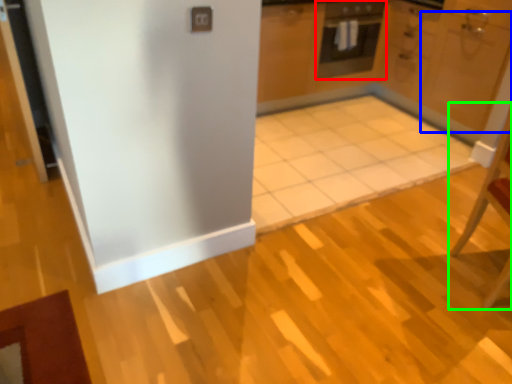
Question: Estimate the real-world distances between objects in this image. Which object is closer to oven (highlighted by a red box), door (highlighted by a blue box) or chair (highlighted by a green box)?

Choices:
 (A) door
 (B) chair

Answer: (A)